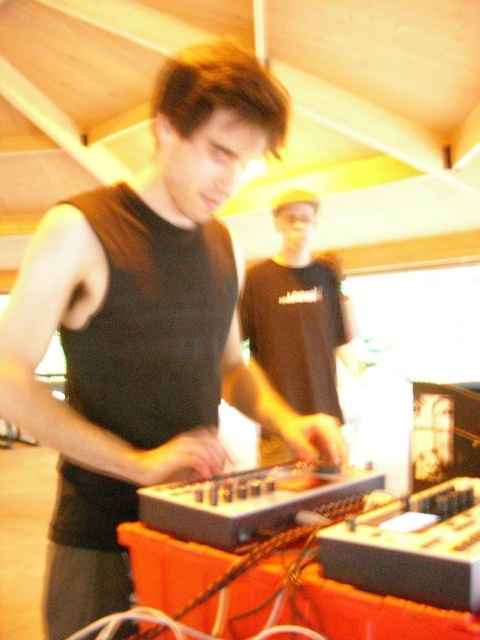
Question: Is black matte tank top at center wider than black plastic mixer at center?

Choices:
 (A) yes
 (B) no

Answer: (A)

Question: Which is nearer to the black matte shirt at center?

Choices:
 (A) black plastic mixer at center
 (B) black matte tank top at center

Answer: (B)

Question: Which of these objects is positioned closest to the black plastic mixer at center?

Choices:
 (A) black matte tank top at center
 (B) black matte shirt at center

Answer: (A)

Question: Which object is farther from the camera taking this photo?

Choices:
 (A) black plastic mixer at center
 (B) black matte shirt at center
 (C) black matte tank top at center

Answer: (B)

Question: Is black matte shirt at center to the right of black plastic mixer at center from the viewer's perspective?

Choices:
 (A) no
 (B) yes

Answer: (B)

Question: Where is black matte tank top at center located in relation to black matte shirt at center in the image?

Choices:
 (A) right
 (B) left

Answer: (B)